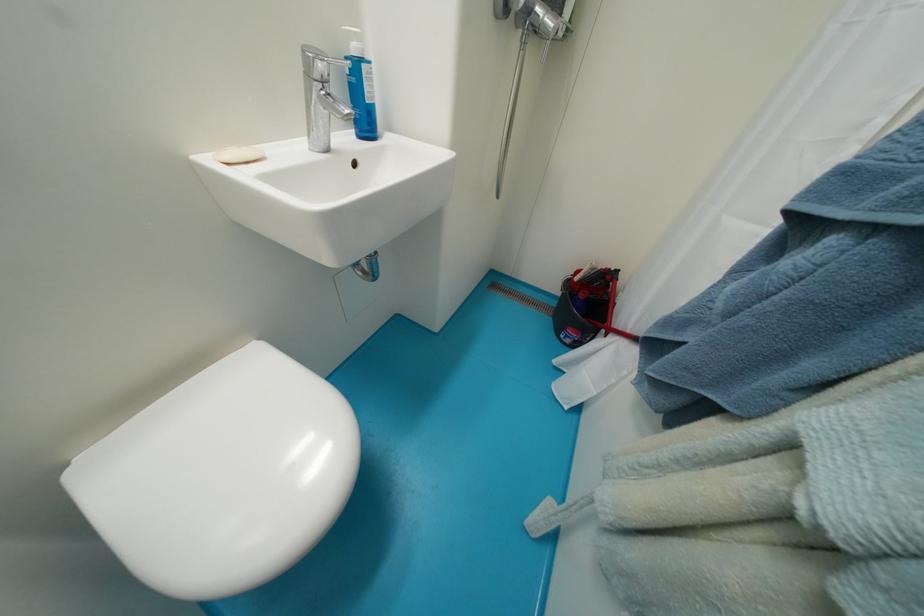
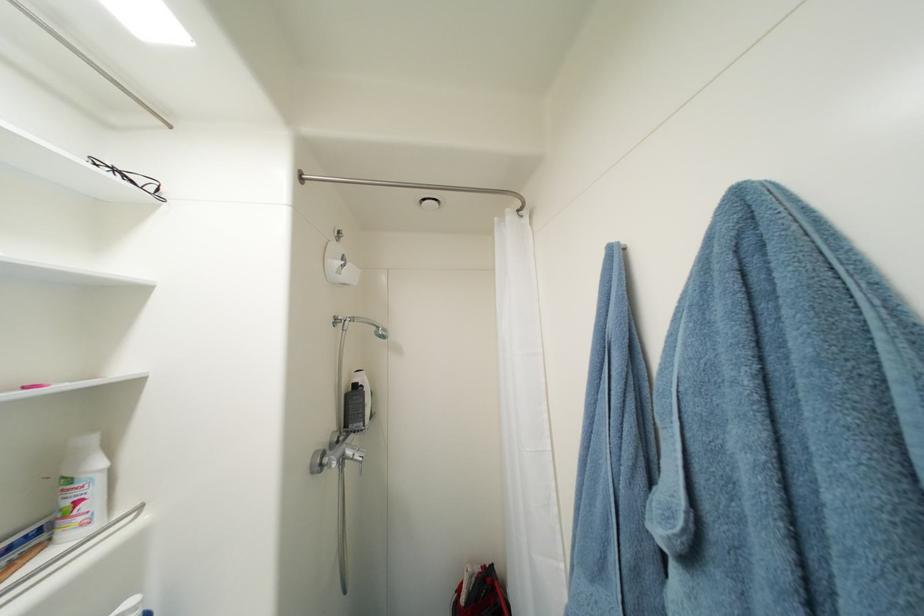
In the second image, find the point that corresponds to pixel 584 281 in the first image.

(469, 602)